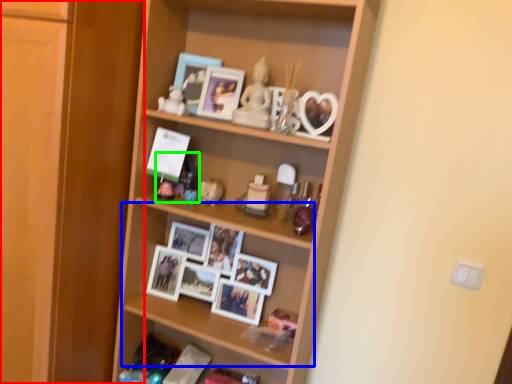
Question: Which is farther away from cabinetry (highlighted by a red box)? shelf (highlighted by a blue box) or toy (highlighted by a green box)?

Choices:
 (A) shelf
 (B) toy

Answer: (A)